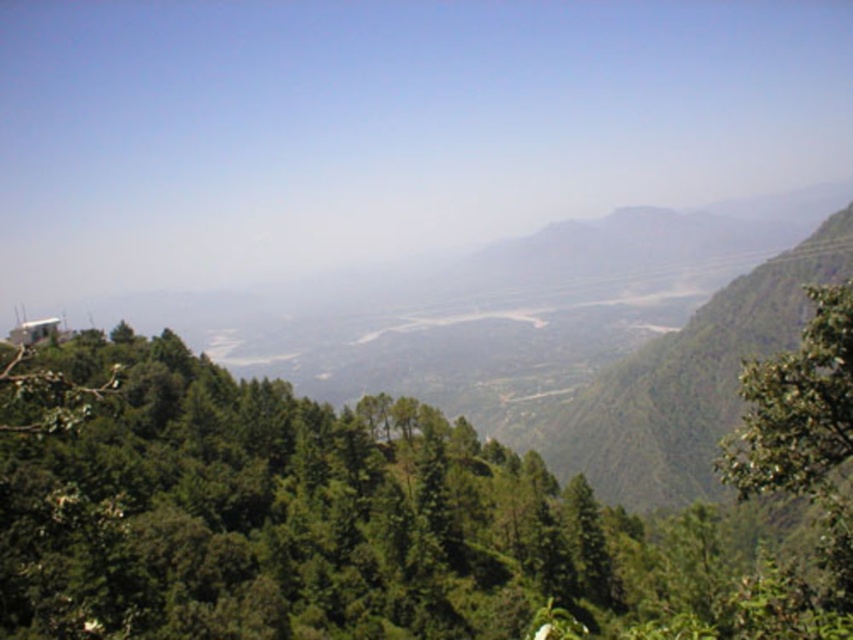
Which is more to the right, green leafy tree at center or green leafy tree at right?

green leafy tree at right

This screenshot has width=853, height=640. I want to click on green leafy tree at center, so click(332, 522).

This screenshot has width=853, height=640. What are the coordinates of `green leafy tree at center` in the screenshot? It's located at (332, 522).